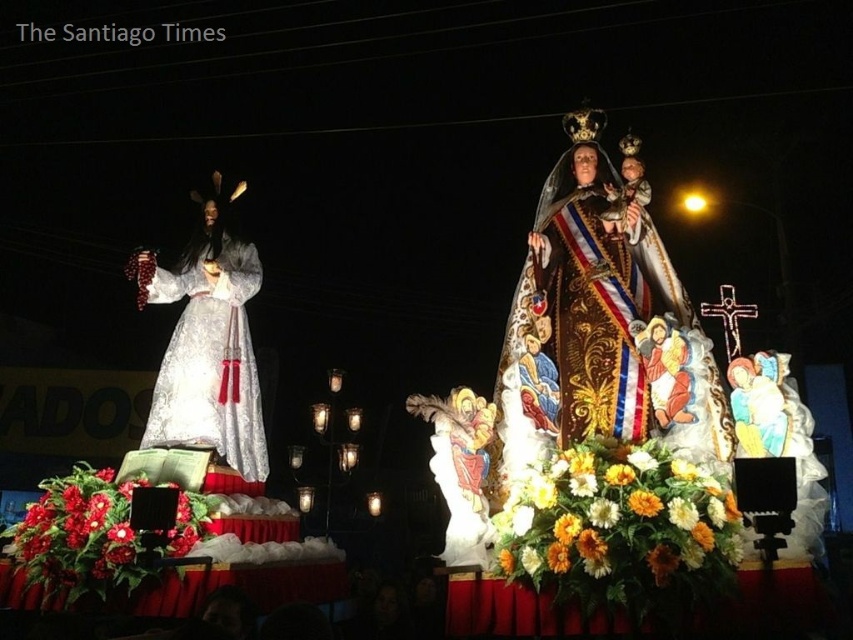
Question: Can you confirm if red floral arrangement at lower left is positioned below red matte flower at center?

Choices:
 (A) no
 (B) yes

Answer: (B)

Question: Which of the following is the closest to the observer?

Choices:
 (A) tap(103, 500)
 (B) tap(741, 525)

Answer: (B)

Question: Which point appears farthest from the camera in this image?

Choices:
 (A) pyautogui.click(x=634, y=477)
 (B) pyautogui.click(x=254, y=476)
 (C) pyautogui.click(x=91, y=477)

Answer: (B)

Question: Which point is farther to the camera?

Choices:
 (A) yellow fabric flowers at center
 (B) red floral arrangement at lower left
 (C) white satin statue at left
 (D) red matte flower at center

Answer: (C)

Question: Is white satin statue at left thinner than red matte flower at center?

Choices:
 (A) yes
 (B) no

Answer: (B)

Question: Can you confirm if white satin statue at left is positioned above red matte flower at center?

Choices:
 (A) yes
 (B) no

Answer: (A)